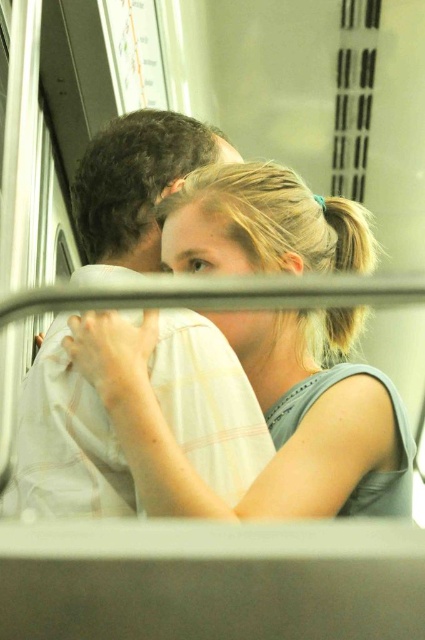
You are a photographer trying to capture a candid shot of the light gray fabric shirt at center and the camera in the scene. Given that your camera has a maximum focus range of 3 feet, will you be able to capture both subjects clearly in the same photo?

The light gray fabric shirt at center and the camera are 3.34 feet apart, which exceeds your camera maximum focus range of 3 feet. Therefore, you won not be able to capture both subjects clearly in the same photo.

You are a photographer trying to capture a candid shot of both the light gray fabric shirt at center and the white cotton shirt at center from your current position. Which shirt should you focus on first to ensure it appears clearer in the photo?

The light gray fabric shirt at center is further to the viewer than the white cotton shirt at center, so you should focus on the light gray fabric shirt at center first to ensure it appears clearer in the photo.

You are a photographer trying to capture the scene between the two people in the image. You need to position your camera so that the light gray fabric shirt at center and the white cotton shirt at center are both in focus. Which shirt should you focus on first to ensure both are sharp?

You should focus on the white cotton shirt at center first because it is closer to the camera than the light gray fabric shirt at center, ensuring both will be in focus when starting from the closer object.